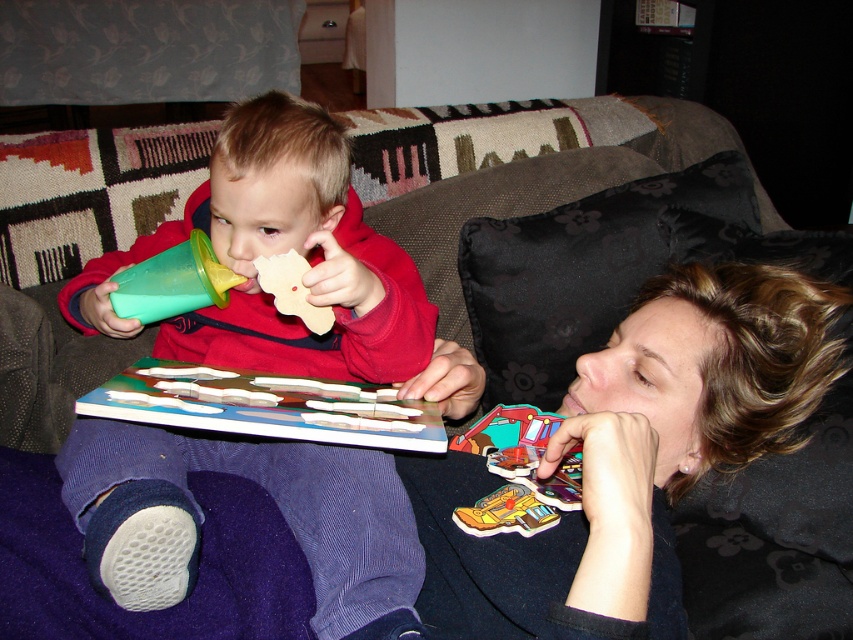
You are a parent trying to organize the items on the table. You need to place the matte black puzzle piece at upper right and the green plastic cup at upper left. According to the scene, which item is closer to you?

The matte black puzzle piece at upper right is in front of the green plastic cup at upper left, so it is closer to you.

You are a parent trying to hand your child a drink. The child is holding a wooden puzzle piece at center and a green plastic cup at upper left. Which object should you move first to give them the drink?

You should move the wooden puzzle piece at center first because the green plastic cup at upper left is already on the left side of it, so moving the puzzle piece would free up space on the right side for the new drink.

You are a delivery robot in the living room and need to place a small package on the surface where the wooden puzzle piece at center is located. Can you reach that surface without moving the matte plastic cup at left?

The matte plastic cup at left is closer to the viewer than the wooden puzzle piece at center, so the surface where the wooden puzzle piece at center is located is further away. The robot can likely reach it without moving the cup since it is closer and might not block the path.